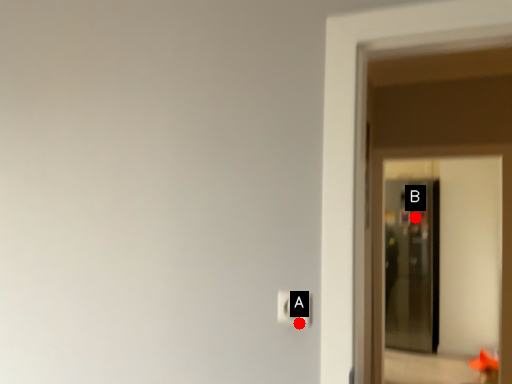
Question: Two points are circled on the image, labeled by A and B beside each circle. Which point appears farthest from the camera in this image?

Choices:
 (A) A is further
 (B) B is further

Answer: (B)